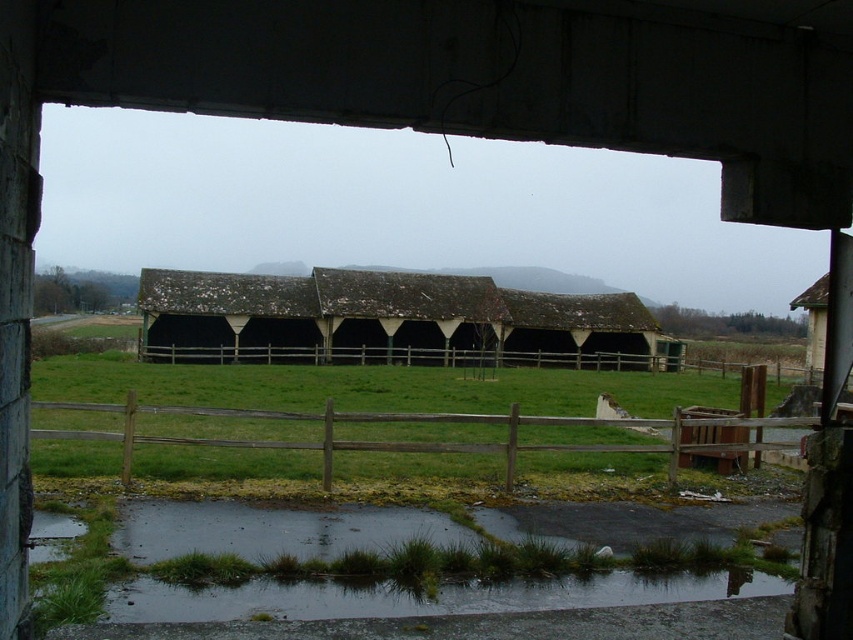
Based on the photo, is rusty metal barn at center shorter than wooden fence at center?

No.

Which is in front, point (604, 323) or point (302, 419)?

Point (302, 419) is in front.

In order to click on rusty metal barn at center in this screenshot , I will do `click(389, 321)`.

This screenshot has width=853, height=640. What are the coordinates of `rusty metal barn at center` in the screenshot? It's located at (389, 321).

Between wooden fence at center and brown wooden fence at center, which one appears on the left side from the viewer's perspective?

From the viewer's perspective, wooden fence at center appears more on the left side.

Is wooden fence at center positioned in front of brown wooden fence at center?

Yes.

Where is `wooden fence at center`? The width and height of the screenshot is (853, 640). wooden fence at center is located at coordinates (419, 442).

Where is `wooden fence at center`? wooden fence at center is located at coordinates (419, 442).

Can you confirm if rusty metal barn at center is taller than brown wooden fence at center?

Correct, rusty metal barn at center is much taller as brown wooden fence at center.

Can you confirm if rusty metal barn at center is shorter than brown wooden fence at center?

In fact, rusty metal barn at center may be taller than brown wooden fence at center.

I want to click on rusty metal barn at center, so click(x=389, y=321).